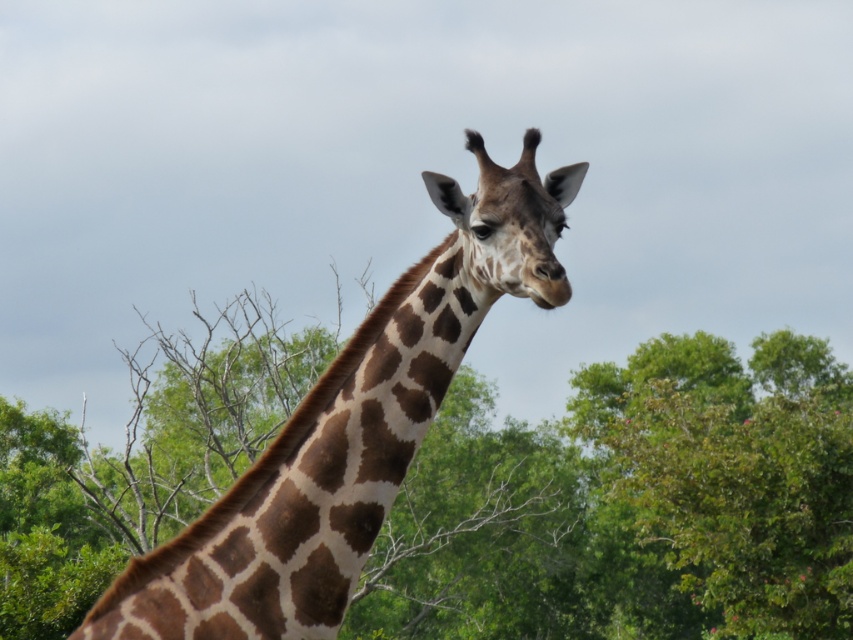
Question: Is green leafy tree at center in front of brown spotted giraffe head at center?

Choices:
 (A) no
 (B) yes

Answer: (A)

Question: Can you confirm if green leafy tree at center is positioned to the left of brown spotted giraffe head at center?

Choices:
 (A) no
 (B) yes

Answer: (B)

Question: Which point is farther to the camera?

Choices:
 (A) brown spotted giraffe at center
 (B) green leafy tree at center

Answer: (B)

Question: Which object is the closest to the green leafy tree at center?

Choices:
 (A) brown spotted giraffe head at center
 (B) brown spotted giraffe at center

Answer: (B)

Question: Which point is farther to the camera?

Choices:
 (A) (675, 433)
 (B) (506, 243)
 (C) (466, 266)

Answer: (A)

Question: Can you confirm if green leafy tree at center is positioned below brown spotted giraffe head at center?

Choices:
 (A) yes
 (B) no

Answer: (A)